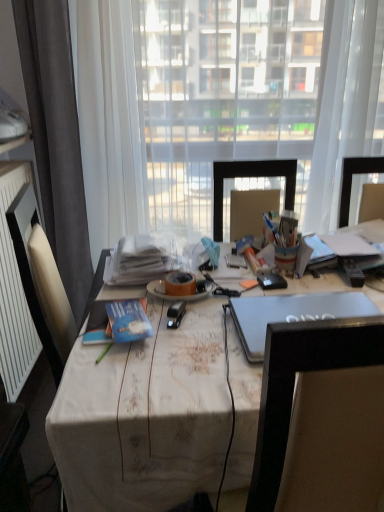
Question: Is transparent fabric at center completely or partially inside white textured radiator at left?

Choices:
 (A) no
 (B) yes

Answer: (A)

Question: From the image's perspective, does white textured radiator at left appear higher than transparent fabric at center?

Choices:
 (A) no
 (B) yes

Answer: (A)

Question: Can you confirm if white textured radiator at left is thinner than transparent fabric at center?

Choices:
 (A) yes
 (B) no

Answer: (A)

Question: Is white textured radiator at left bigger than transparent fabric at center?

Choices:
 (A) no
 (B) yes

Answer: (A)

Question: Is white textured radiator at left positioned beyond the bounds of transparent fabric at center?

Choices:
 (A) no
 (B) yes

Answer: (B)

Question: Looking at the image, does translucent orange adhesive tape at center seem bigger or smaller compared to white fabric-covered desk at center?

Choices:
 (A) big
 (B) small

Answer: (B)

Question: Relative to white fabric-covered desk at center, is translucent orange adhesive tape at center in front or behind?

Choices:
 (A) front
 (B) behind

Answer: (B)

Question: In terms of width, does translucent orange adhesive tape at center look wider or thinner when compared to white fabric-covered desk at center?

Choices:
 (A) thin
 (B) wide

Answer: (A)

Question: Does point (192, 289) appear closer or farther from the camera than point (372, 237)?

Choices:
 (A) farther
 (B) closer

Answer: (B)

Question: From the image's perspective, is blue matte book at center, the 1th book ordered from the bottom, above or below white paper stack at center, the second book in the front-to-back sequence?

Choices:
 (A) above
 (B) below

Answer: (B)

Question: From a real-world perspective, is blue matte book at center, arranged as the 2th book when viewed from the back, physically located above or below white paper stack at center, positioned as the first book in top-to-bottom order?

Choices:
 (A) below
 (B) above

Answer: (A)

Question: Is blue matte book at center, placed as the second book when sorted from top to bottom, wider or thinner than white paper stack at center, the second book in the front-to-back sequence?

Choices:
 (A) thin
 (B) wide

Answer: (A)

Question: Considering the positions of blue matte book at center, placed as the second book when sorted from top to bottom, and white paper stack at center, the second book in the front-to-back sequence, in the image, is blue matte book at center, placed as the second book when sorted from top to bottom, bigger or smaller than white paper stack at center, the second book in the front-to-back sequence,?

Choices:
 (A) small
 (B) big

Answer: (A)

Question: Based on their sizes in the image, would you say blue matte book at center, the 1th book ordered from the bottom, is bigger or smaller than transparent fabric at center?

Choices:
 (A) small
 (B) big

Answer: (A)

Question: From a real-world perspective, relative to transparent fabric at center, is blue matte book at center, the 1th book ordered from the bottom, vertically above or below?

Choices:
 (A) above
 (B) below

Answer: (B)